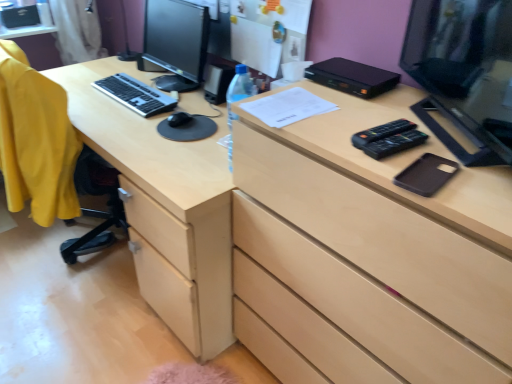
Where is `free space to the right of silver metallic keyboard at center-left`? The height and width of the screenshot is (384, 512). free space to the right of silver metallic keyboard at center-left is located at coordinates (179, 87).